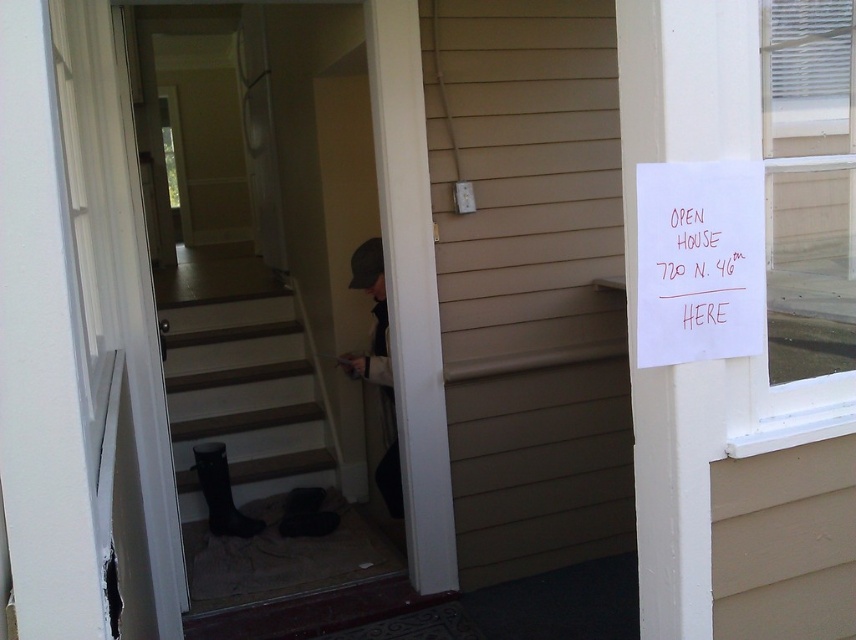
Question: Is red paper sign at upper right bigger than dark gray knit hat at center?

Choices:
 (A) no
 (B) yes

Answer: (A)

Question: Which point is closer to the camera taking this photo?

Choices:
 (A) (318, 477)
 (B) (758, 308)

Answer: (B)

Question: Estimate the real-world distances between objects in this image. Which object is farther from the red paper sign at upper right?

Choices:
 (A) dark gray knit hat at center
 (B) black rubber stair at lower left

Answer: (B)

Question: Can you confirm if black rubber stair at lower left is bigger than dark gray knit hat at center?

Choices:
 (A) no
 (B) yes

Answer: (B)

Question: Can you confirm if red paper sign at upper right is positioned below dark gray knit hat at center?

Choices:
 (A) yes
 (B) no

Answer: (B)

Question: Considering the real-world distances, which object is farthest from the red paper sign at upper right?

Choices:
 (A) black rubber stair at lower left
 (B) dark gray knit hat at center

Answer: (A)